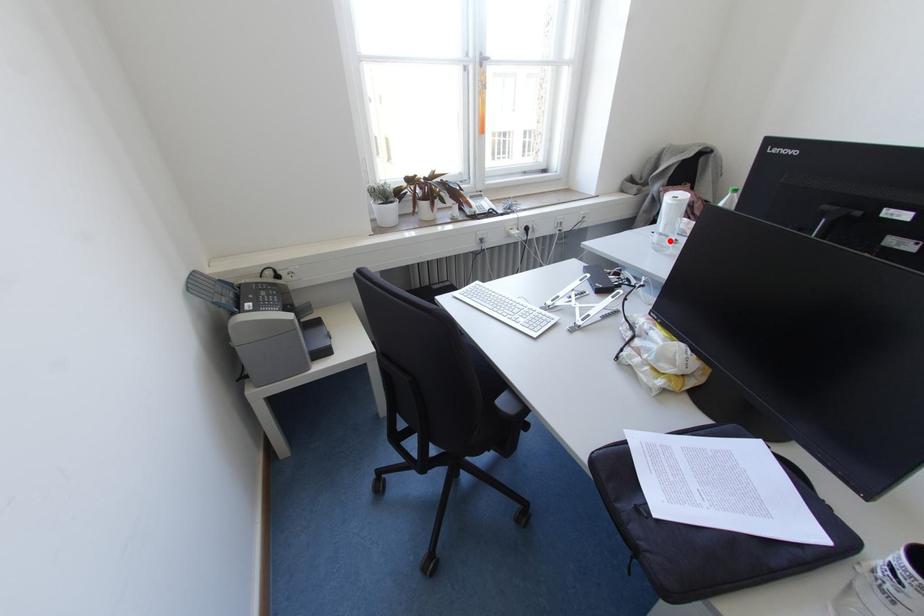
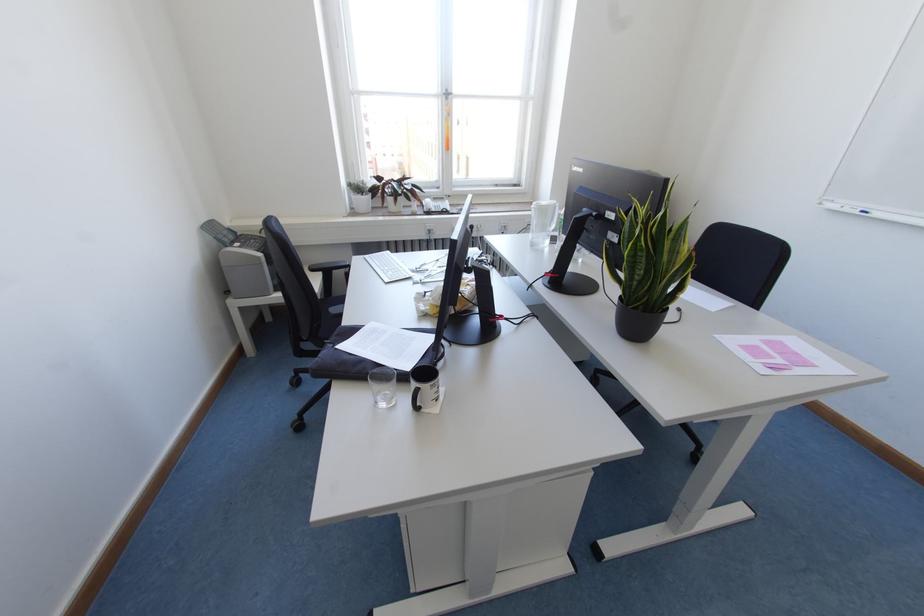
Question: I am providing you with two images of the same scene from different viewpoints. In image1, a red point is highlighted. Considering the same 3D point in image2, which of the following is correct?

Choices:
 (A) It is closer
 (B) It is farther

Answer: (A)